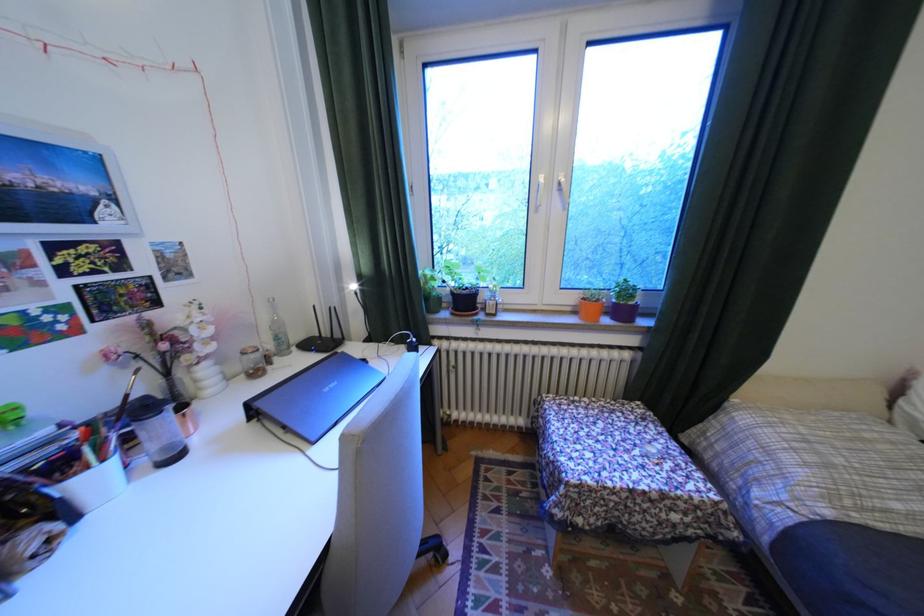
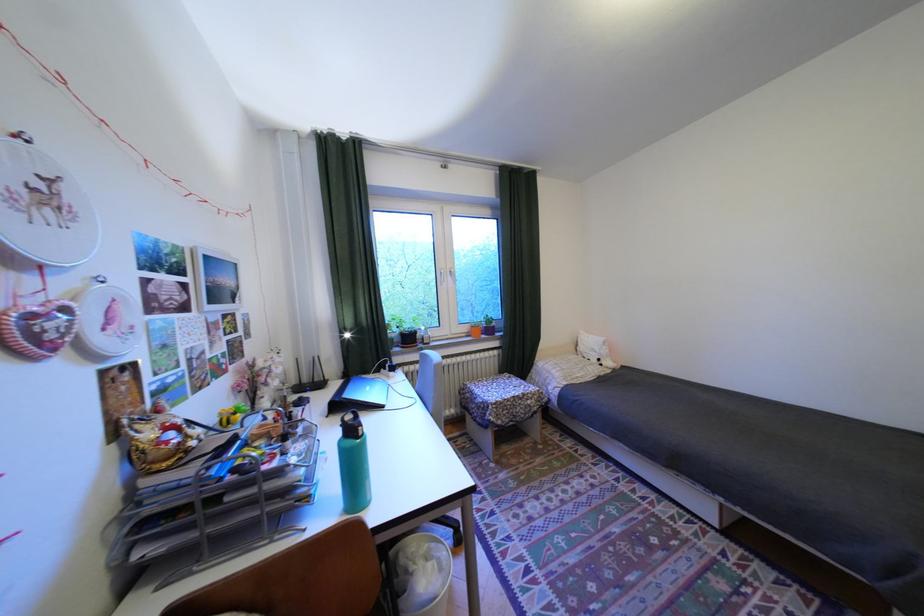
Find the pixel in the second image that matches point (548, 211) in the first image.

(454, 285)